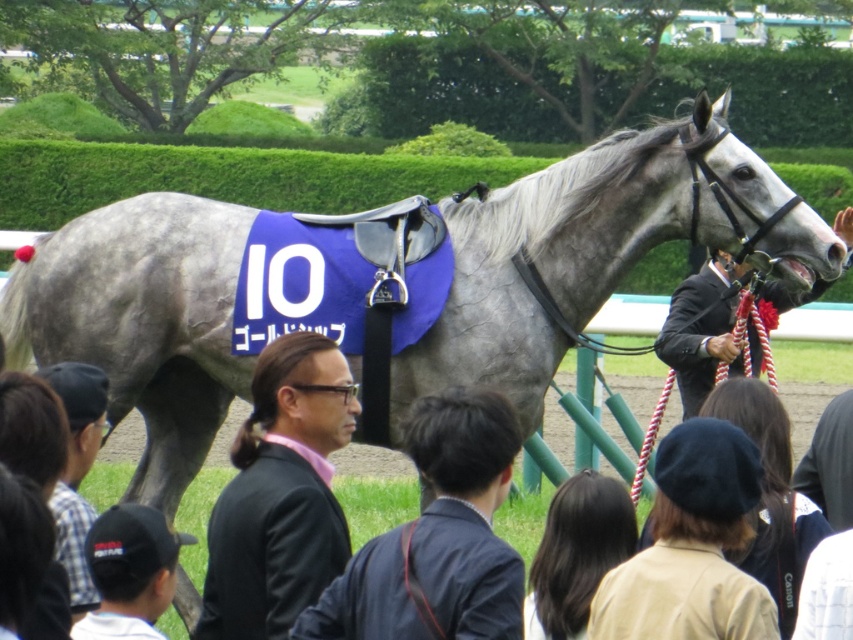
You are standing at the starting line of the horse race and see two points marked on the track. The first point is at coordinate point[68,496] and the second point is at coordinate point[693,388]. Which point is closer to you?

Point point[68,496] is in front of point point[693,388], so it is closer to you.

You are a photographer at the horse racing event. You want to take a photo that includes both the plaid shirt at lower left and the black suit at center. Which object should you focus on first to ensure both are in sharp focus?

The plaid shirt at lower left is closer to the viewer than the black suit at center. To ensure both are in sharp focus, you should focus on the plaid shirt at lower left first, as it is the closer object.

You are a photographer at the horse racing event and want to take a photo of the gray horse with the purple saddle cloth number 10. You notice two people in the foreground blocking your view. One is wearing a black matte suit at center and the other is wearing a plaid shirt at lower left. Which person is closer to you and should you ask to step aside first?

The black matte suit at center is closer to you than the plaid shirt at lower left, so you should ask the person in the black matte suit at center to step aside first.